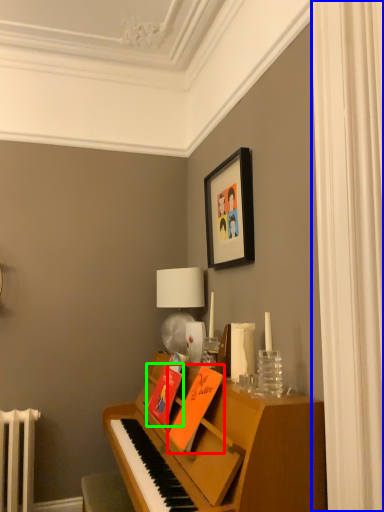
Question: Estimate the real-world distances between objects in this image. Which object is closer to book (highlighted by a red box), curtain (highlighted by a blue box) or book (highlighted by a green box)?

Choices:
 (A) curtain
 (B) book

Answer: (B)